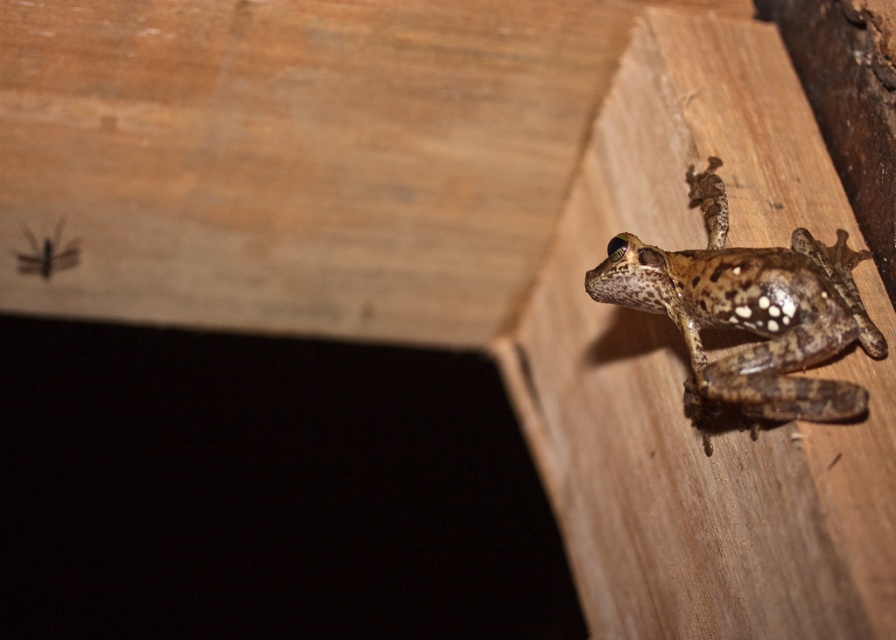
You are a photographer trying to capture the frog on the wooden surface. Based on the scene, which object is taller between the brown wood plank at upper right and the speckled brown skin at upper right?

The brown wood plank at upper right is taller than the speckled brown skin at upper right according to the description.

You are a photographer trying to capture a close up of the speckled brown skin at upper right and the brown fuzzy insect at upper left. Which one should you zoom in on to ensure both are in focus?

The speckled brown skin at upper right is bigger than the brown fuzzy insect at upper left, so you should zoom in on the speckled brown skin at upper right to ensure both are in focus.